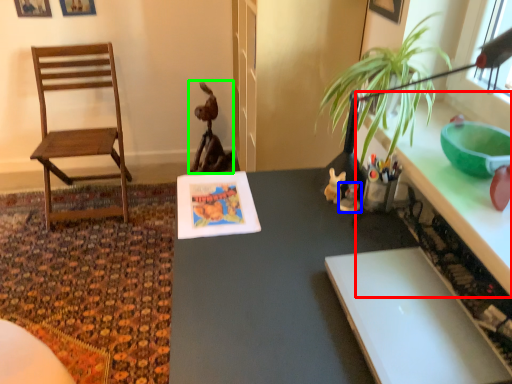
Question: Considering the real-world distances, which object is closest to counter top (highlighted by a red box)? toy (highlighted by a blue box) or animal (highlighted by a green box).

Choices:
 (A) toy
 (B) animal

Answer: (A)